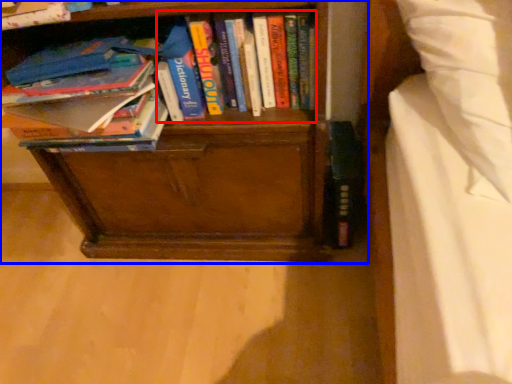
Question: Which point is further to the camera, book (highlighted by a red box) or bookcase (highlighted by a blue box)?

Choices:
 (A) book
 (B) bookcase

Answer: (A)